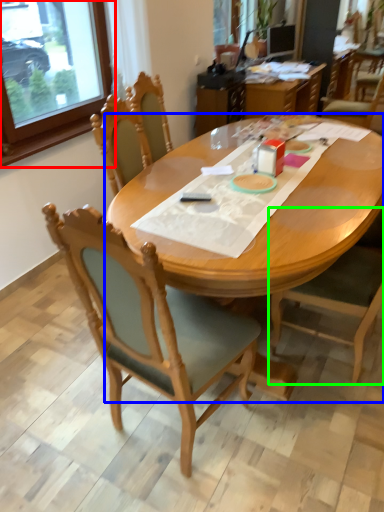
Question: Based on their relative distances, which object is nearer to window frame (highlighted by a red box)? Choose from desk (highlighted by a blue box) and chair (highlighted by a green box).

Choices:
 (A) desk
 (B) chair

Answer: (A)